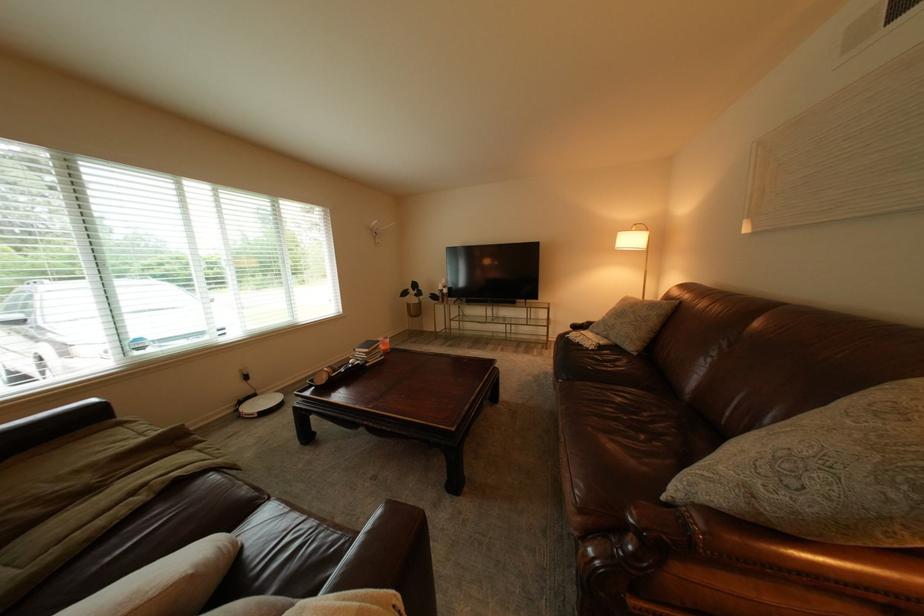
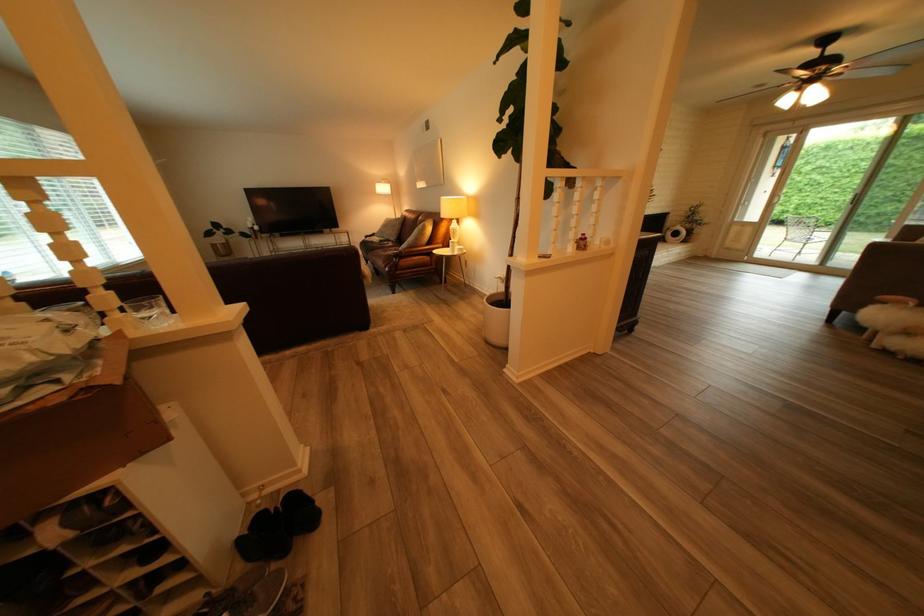
Locate, in the second image, the point that corresponds to [590,337] in the first image.

(383, 240)